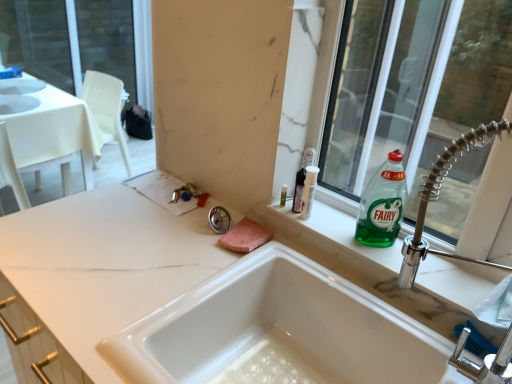
Locate an element on the screen. This screenshot has width=512, height=384. vacant space in front of green glass bottle at upper right is located at coordinates [394, 265].